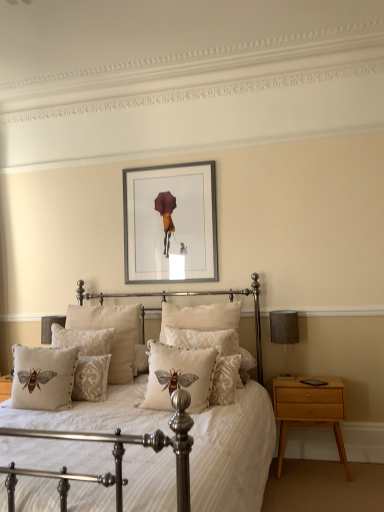
Question: Does silver metallic picture frame at upper center have a lesser height compared to beige embroidered cushion with bee design at center, acting as the second pillow starting from the front?

Choices:
 (A) yes
 (B) no

Answer: (B)

Question: Considering the relative sizes of silver metallic picture frame at upper center and beige embroidered cushion with bee design at center, acting as the second pillow starting from the front, in the image provided, is silver metallic picture frame at upper center taller than beige embroidered cushion with bee design at center, acting as the second pillow starting from the front,?

Choices:
 (A) yes
 (B) no

Answer: (A)

Question: Is silver metallic picture frame at upper center next to beige embroidered cushion with bee design at center, acting as the second pillow starting from the front, and touching it?

Choices:
 (A) no
 (B) yes

Answer: (A)

Question: Would you consider silver metallic picture frame at upper center to be distant from beige embroidered cushion with bee design at center, acting as the second pillow starting from the front?

Choices:
 (A) yes
 (B) no

Answer: (A)

Question: Does silver metallic picture frame at upper center turn towards beige embroidered cushion with bee design at center, the 5th pillow positioned from the back?

Choices:
 (A) no
 (B) yes

Answer: (A)

Question: Choose the correct answer: Is beige damask pillow at center, acting as the 1th pillow starting from the back, inside beige damask pillow at center, positioned as the fifth pillow in front-to-back order, or outside it?

Choices:
 (A) outside
 (B) inside

Answer: (A)

Question: Relative to beige damask pillow at center, the 2th pillow in the back-to-front sequence, is beige damask pillow at center, the 6th pillow from the front, in front or behind?

Choices:
 (A) front
 (B) behind

Answer: (B)

Question: Considering the positions of beige damask pillow at center, acting as the 1th pillow starting from the back, and beige damask pillow at center, the 2th pillow in the back-to-front sequence, in the image, is beige damask pillow at center, acting as the 1th pillow starting from the back, bigger or smaller than beige damask pillow at center, the 2th pillow in the back-to-front sequence,?

Choices:
 (A) small
 (B) big

Answer: (B)

Question: Is beige damask pillow at center, the 6th pillow from the front, wider or thinner than beige damask pillow at center, positioned as the fifth pillow in front-to-back order?

Choices:
 (A) thin
 (B) wide

Answer: (B)

Question: Considering their positions, is white textured pillow with bee design at center, arranged as the 4th pillow when viewed from the back, located in front of or behind light brown wood nightstand at right?

Choices:
 (A) front
 (B) behind

Answer: (A)

Question: From the image's perspective, relative to light brown wood nightstand at right, is white textured pillow with bee design at center, the 3th pillow viewed from the front, above or below?

Choices:
 (A) above
 (B) below

Answer: (A)

Question: In terms of size, does white textured pillow with bee design at center, arranged as the 4th pillow when viewed from the back, appear bigger or smaller than light brown wood nightstand at right?

Choices:
 (A) small
 (B) big

Answer: (A)

Question: Is point (221, 355) positioned closer to the camera than point (299, 404)?

Choices:
 (A) closer
 (B) farther

Answer: (A)

Question: From the image's perspective, is white textured pillow with bee design at center, arranged as the 4th pillow when viewed from the back, located above or below beige damask pillow at center, positioned as the fifth pillow in front-to-back order?

Choices:
 (A) below
 (B) above

Answer: (B)

Question: Is point (228, 373) closer or farther from the camera than point (52, 344)?

Choices:
 (A) closer
 (B) farther

Answer: (A)